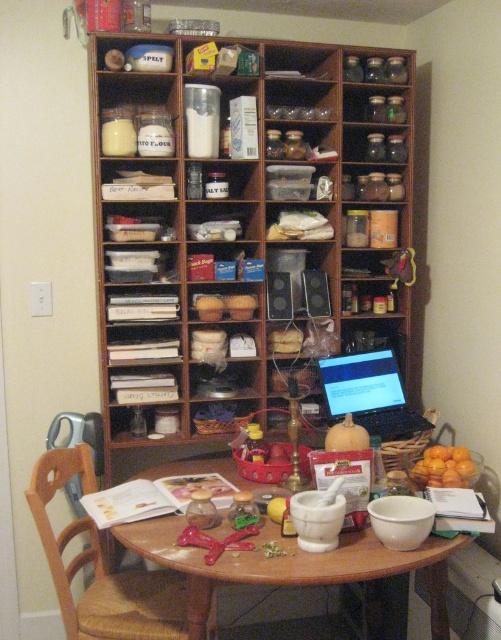
Question: Does white ceramic mortar and pestle at center appear on the left side of black plastic laptop at center?

Choices:
 (A) yes
 (B) no

Answer: (A)

Question: Can you confirm if wooden at left is positioned to the right of yellow matte pumpkin at center?

Choices:
 (A) yes
 (B) no

Answer: (B)

Question: Which object is positioned farthest from the black plastic laptop at center?

Choices:
 (A) white ceramic mortar and pestle at center
 (B) wooden at left
 (C) wooden bookshelf at center

Answer: (B)

Question: Can you confirm if black plastic laptop at center is bigger than orange matte at right?

Choices:
 (A) no
 (B) yes

Answer: (B)

Question: Among these objects, which one is nearest to the camera?

Choices:
 (A) wooden at left
 (B) orange matte at right
 (C) wooden bookshelf at center

Answer: (A)

Question: Which object is closer to the camera taking this photo?

Choices:
 (A) yellow matte pumpkin at center
 (B) orange matte at right
 (C) wooden bookshelf at center

Answer: (A)